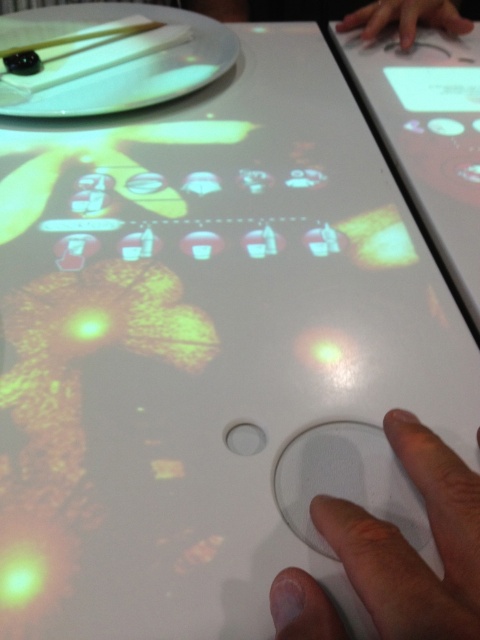
Is point (434, 515) farther from viewer compared to point (455, 28)?

No, (434, 515) is in front of (455, 28).

Is transparent plastic hand at bottom right taller than smooth skin hand at upper right?

No.

Is point (382, 609) in front of point (384, 19)?

Yes, it is.

Identify the location of transparent plastic hand at bottom right. (411, 547).